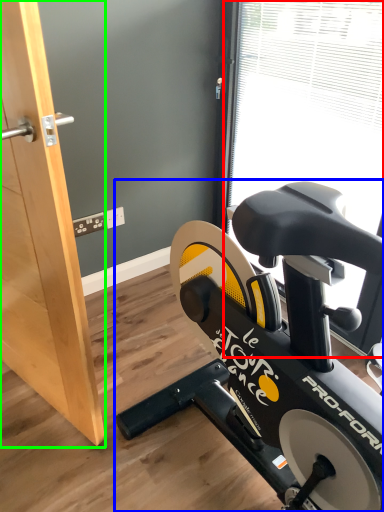
Question: Which object is the farthest from window screen (highlighted by a red box)? Choose among these: stationary bicycle (highlighted by a blue box) or screen door (highlighted by a green box).

Choices:
 (A) stationary bicycle
 (B) screen door

Answer: (B)